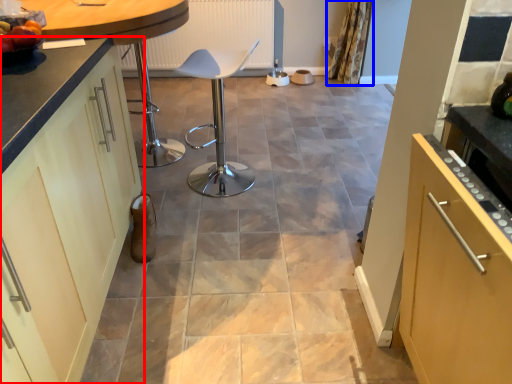
Question: Which object is closer to the camera taking this photo, cabinetry (highlighted by a red box) or curtain (highlighted by a blue box)?

Choices:
 (A) cabinetry
 (B) curtain

Answer: (A)